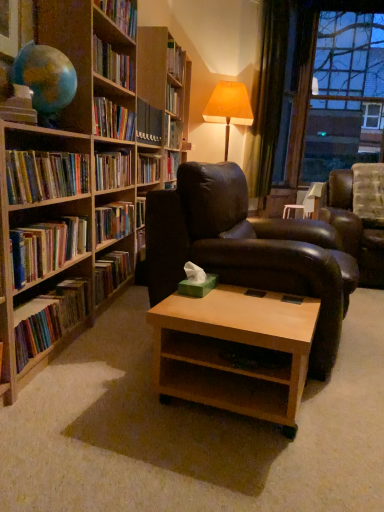
The height and width of the screenshot is (512, 384). I want to click on vacant space situated on the left part of light brown wood coffee table at center, so click(x=104, y=396).